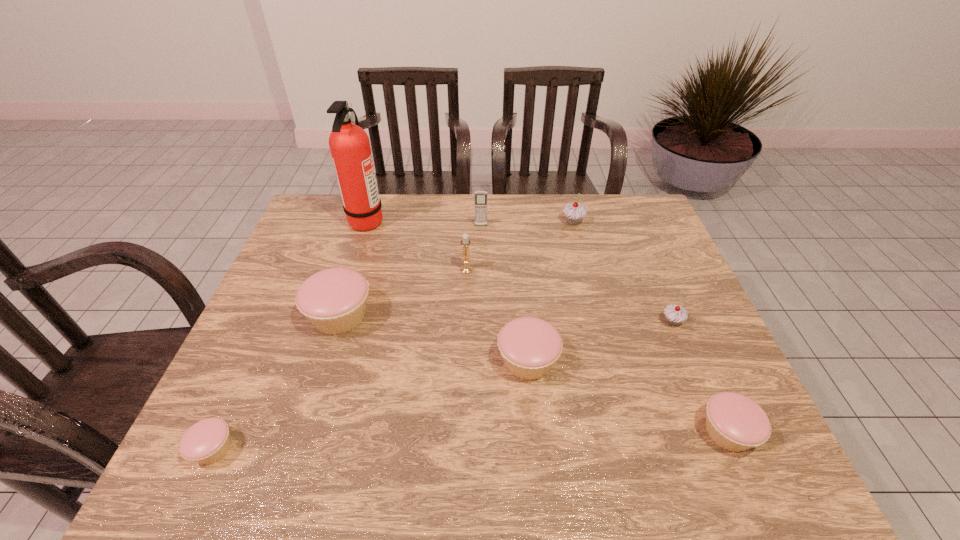
What are the coordinates of `vacant space in between the fifth object from right to left and the farther gray cupcake` in the screenshot? It's located at (527, 224).

The width and height of the screenshot is (960, 540). I want to click on free space between the third cupcake from left to right and the fifth cupcake from right to left, so click(x=434, y=339).

This screenshot has width=960, height=540. Find the location of `vacant region between the smaller gray cupcake and the seventh object from left to right`. vacant region between the smaller gray cupcake and the seventh object from left to right is located at coordinates (623, 272).

You are a GUI agent. You are given a task and a screenshot of the screen. Output one action in this format:
    pyautogui.click(x=<x>, y=<y>)
    Task: Click on the free space between the right gray cupcake and the fourth object from right to left
    
    Given the screenshot: What is the action you would take?
    pyautogui.click(x=600, y=341)

Find the location of `empty space that is in between the fire extinguisher and the leftmost pink cupcake`. empty space that is in between the fire extinguisher and the leftmost pink cupcake is located at coordinates (290, 335).

I want to click on vacant area between the smaller gray cupcake and the rightmost pink cupcake, so click(700, 377).

Find the location of a particular element. This screenshot has width=960, height=540. free space between the farther gray cupcake and the fifth cupcake from right to left is located at coordinates (456, 269).

You are a GUI agent. You are given a task and a screenshot of the screen. Output one action in this format:
    pyautogui.click(x=<x>, y=<y>)
    Task: Click on the free spot between the red fire extinguisher and the sixth object from right to left
    
    Given the screenshot: What is the action you would take?
    pyautogui.click(x=417, y=245)

Image resolution: width=960 pixels, height=540 pixels. In order to click on empty space that is in between the nearer gray cupcake and the third cupcake from left to right in this screenshot , I will do `click(600, 341)`.

This screenshot has width=960, height=540. What are the coordinates of `the eighth closest object to the second pink cupcake from right to left` in the screenshot? It's located at (207, 441).